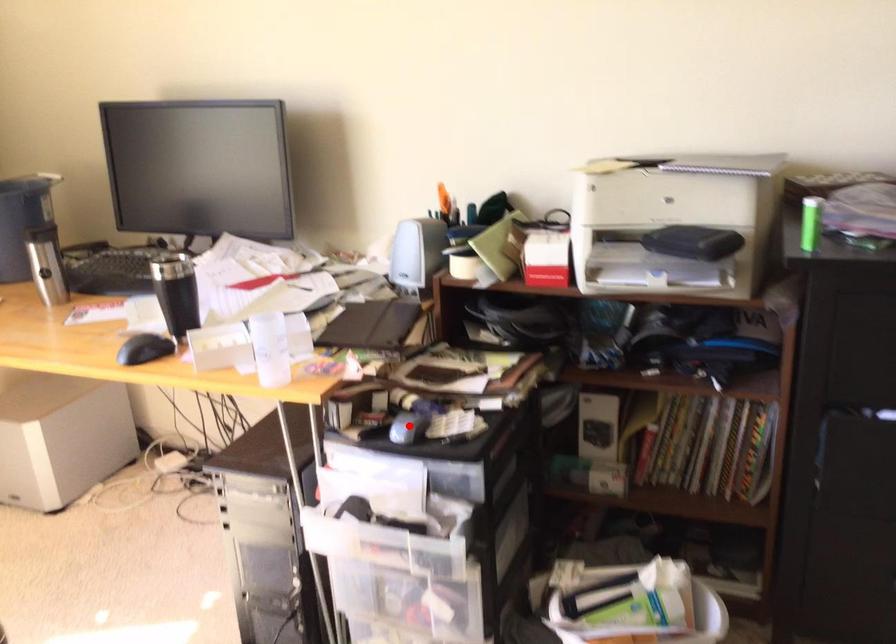
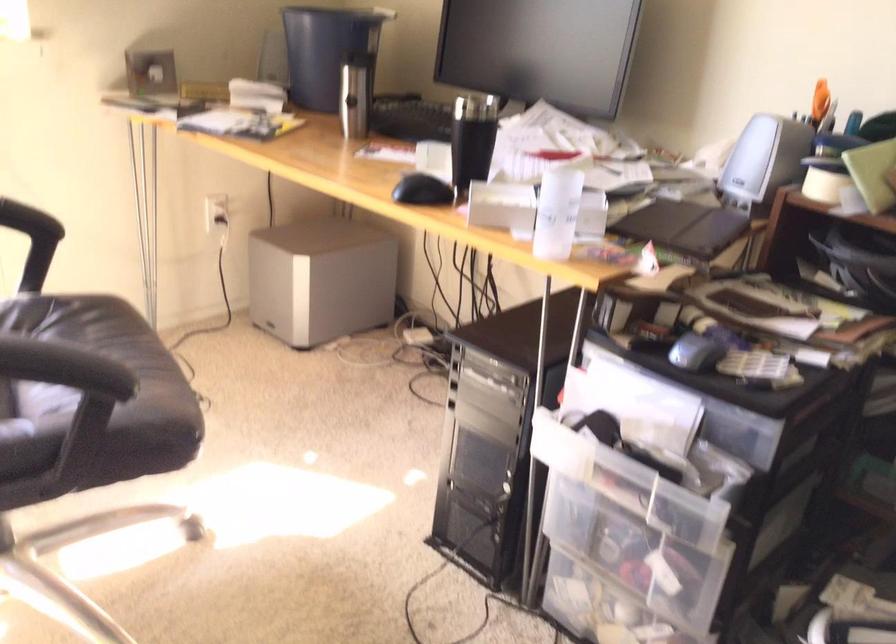
In the second image, find the point that corresponds to the highlighted location in the first image.

(695, 352)